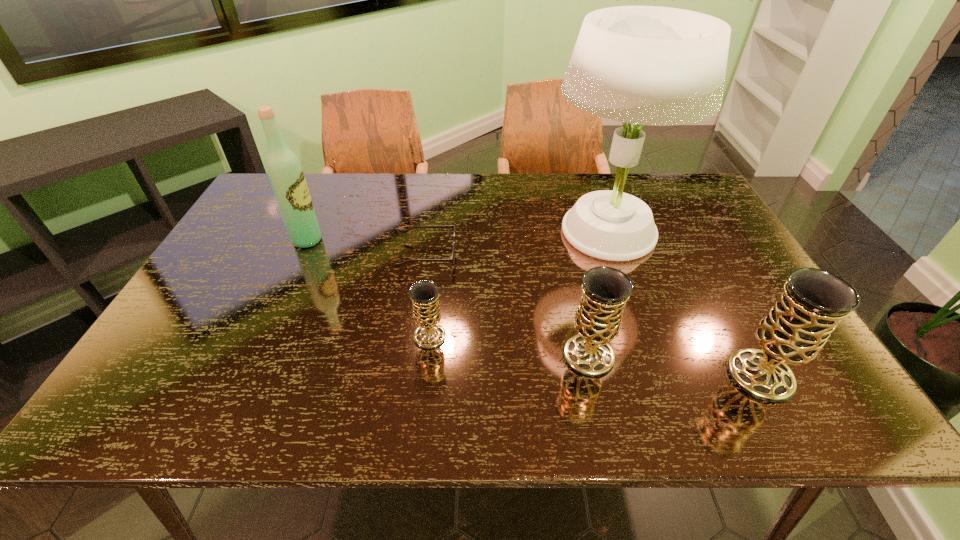
Where is `the leftmost chalice`? Image resolution: width=960 pixels, height=540 pixels. the leftmost chalice is located at coordinates (424, 294).

Locate an element on the screen. the shortest chalice is located at coordinates (424, 294).

You are a GUI agent. You are given a task and a screenshot of the screen. Output one action in this format:
    pyautogui.click(x=<x>, y=<y>)
    Task: Click on the fourth tallest object
    The height and width of the screenshot is (540, 960).
    Given the screenshot: What is the action you would take?
    pyautogui.click(x=605, y=290)

The height and width of the screenshot is (540, 960). I want to click on the second chalice from left to right, so click(x=605, y=290).

Where is `the rightmost chalice`? The height and width of the screenshot is (540, 960). the rightmost chalice is located at coordinates (813, 302).

Where is `lamp`? lamp is located at coordinates (647, 65).

I want to click on sunglasses, so click(452, 259).

Locate an element on the screen. The image size is (960, 540). the fifth shortest object is located at coordinates (285, 173).

At what (x,y) coordinates should I click in order to perform the action: click on the leftmost object. Please return your answer as a coordinate pair (x, y). The height and width of the screenshot is (540, 960). Looking at the image, I should click on (x=285, y=173).

Find the location of a particular element. vacant space located on the left of the second shortest object is located at coordinates (366, 336).